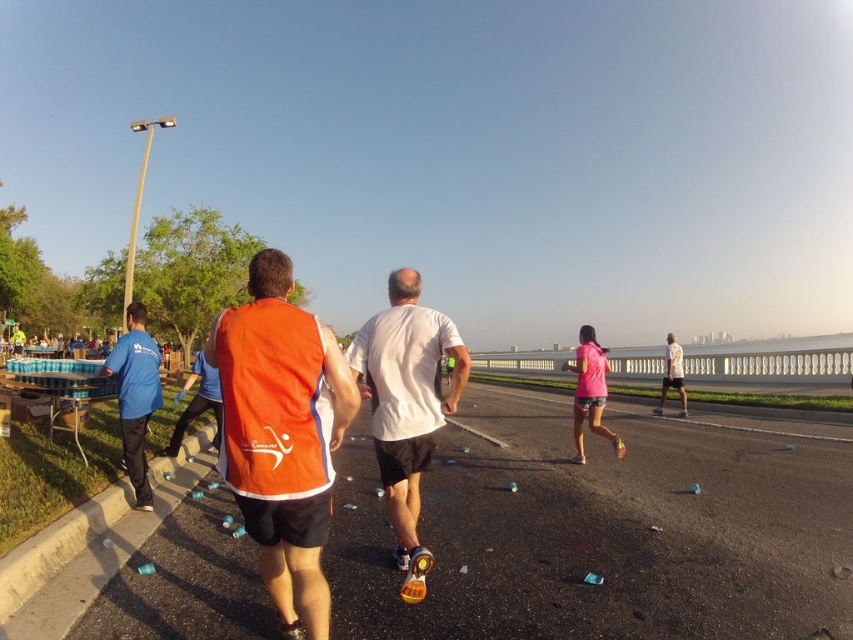
Question: Which object is closer to the camera taking this photo?

Choices:
 (A) pink matte shorts at center
 (B) blue fabric shirt at left
 (C) orange fabric vest at center
 (D) white matte shirt at center

Answer: (C)

Question: Does white matte shirt at center have a greater width compared to blue fabric shirt at left?

Choices:
 (A) yes
 (B) no

Answer: (B)

Question: Can you confirm if white matte shirt at center is positioned above blue fabric shirt at left?

Choices:
 (A) no
 (B) yes

Answer: (B)

Question: From the image, what is the correct spatial relationship of orange fabric vest at center in relation to pink matte shorts at center?

Choices:
 (A) right
 (B) left

Answer: (B)

Question: Which object is the closest to the orange fabric vest at center?

Choices:
 (A) blue fabric shirt at left
 (B) white matte shirt at center

Answer: (B)

Question: Which is nearer to the blue fabric shirt at left?

Choices:
 (A) orange fabric vest at center
 (B) white matte shirt at center

Answer: (B)